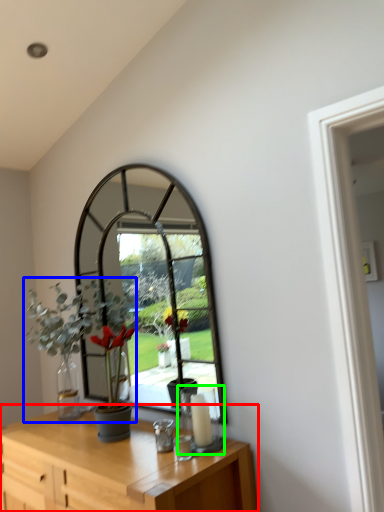
Question: Considering the real-world distances, which object is farthest from table (highlighted by a red box)? houseplant (highlighted by a blue box) or candle holder (highlighted by a green box)?

Choices:
 (A) houseplant
 (B) candle holder

Answer: (A)